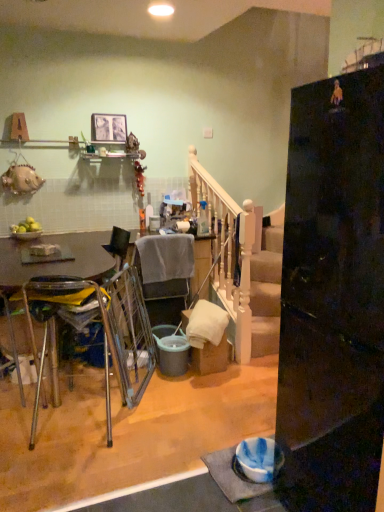
Question: From their relative heights in the image, would you say translucent glass bottle at upper center is taller or shorter than white wooden rail at center?

Choices:
 (A) tall
 (B) short

Answer: (B)

Question: Is translucent glass bottle at upper center to the left or to the right of white wooden rail at center in the image?

Choices:
 (A) right
 (B) left

Answer: (B)

Question: Estimate the real-world distances between objects in this image. Which object is farther from the glossy black refrigerator at right?

Choices:
 (A) matte gray bucket at center
 (B) matte glass picture frame at upper center
 (C) metallic silver swivel chair at center
 (D) white wooden rail at center
 (E) translucent glass bottle at upper center

Answer: (B)

Question: Estimate the real-world distances between objects in this image. Which object is closer to the gray fabric chair at center, which is the first chair from right to left?

Choices:
 (A) white wooden rail at center
 (B) matte gray bucket at center
 (C) metallic silver chair at left, which is the second chair in right-to-left order
 (D) matte glass picture frame at upper center
 (E) glossy black refrigerator at right

Answer: (B)